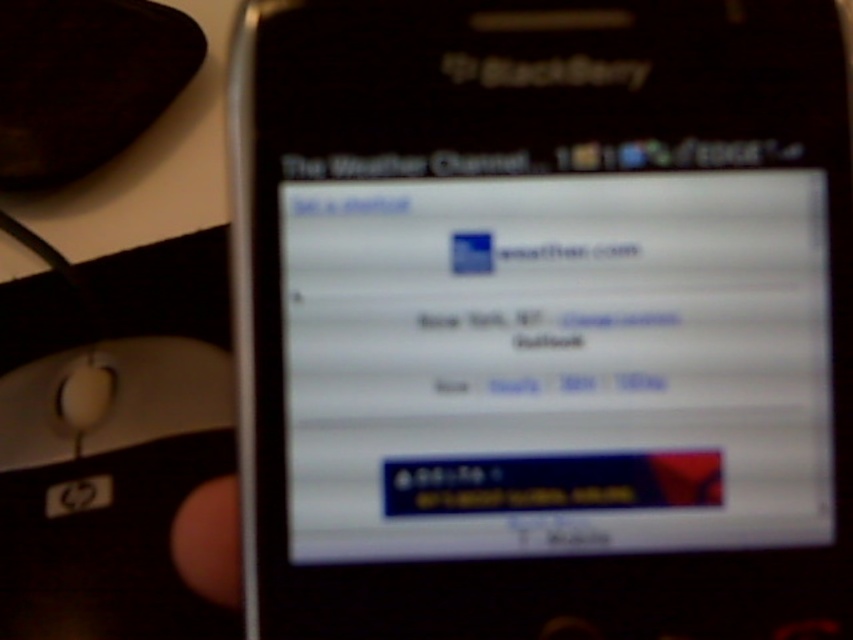
Between black matte smartphone at center and white plastic mouse at lower left, which one has less height?

white plastic mouse at lower left is shorter.

Does black matte smartphone at center appear on the right side of white plastic mouse at lower left?

Yes, black matte smartphone at center is to the right of white plastic mouse at lower left.

Between point (624, 557) and point (9, 428), which one is positioned behind?

Positioned behind is point (9, 428).

Find the location of a particular element. black matte smartphone at center is located at coordinates (543, 317).